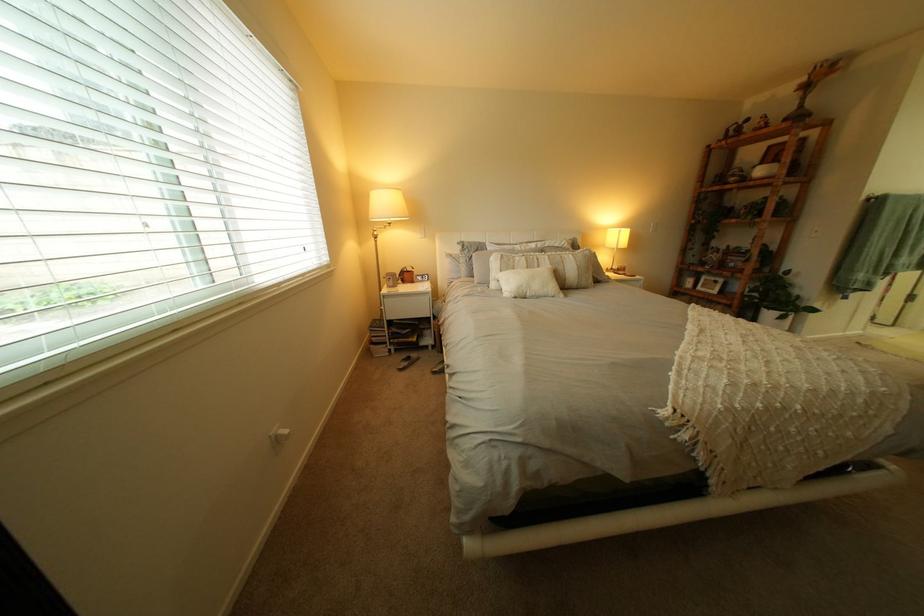
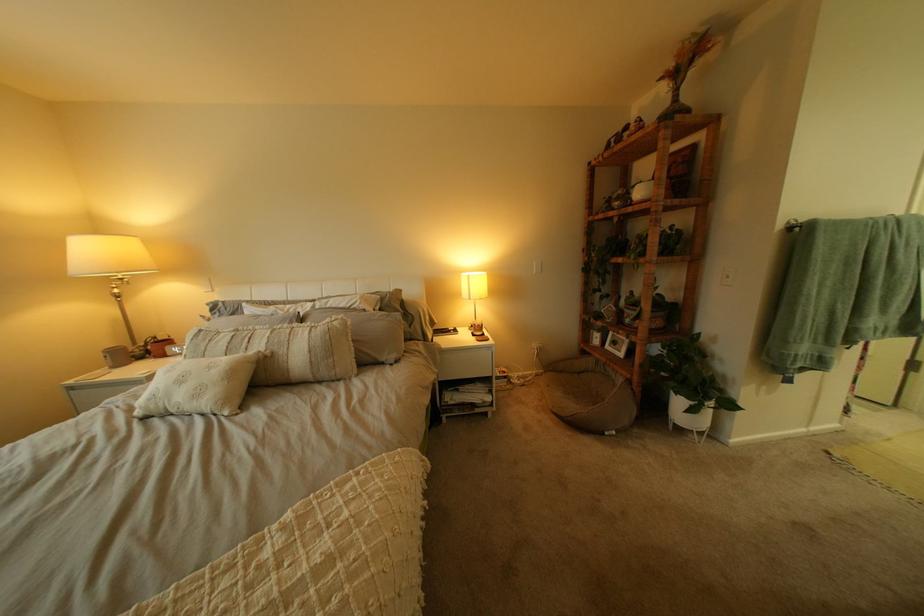
Locate, in the second image, the point that corresponds to (x=714, y=290) in the first image.

(623, 347)